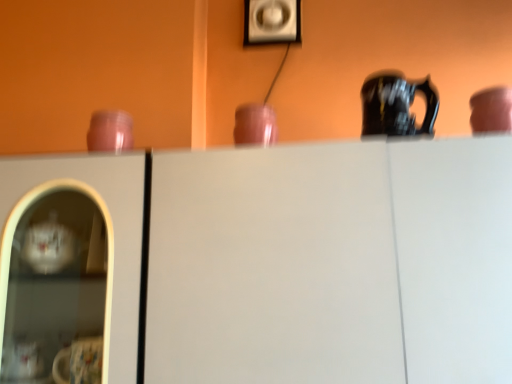
The width and height of the screenshot is (512, 384). Describe the element at coordinates (260, 264) in the screenshot. I see `white matte cabinet at center` at that location.

Where is `pink glossy jar at left, placed as the third tableware when sorted from right to left`? pink glossy jar at left, placed as the third tableware when sorted from right to left is located at coordinates (110, 131).

This screenshot has height=384, width=512. I want to click on matte pink cup at center, acting as the second tableware starting from the right, so click(x=255, y=125).

Is matte pink cup at center, acting as the second tableware starting from the right, next to matte plastic picture frame at upper center?

They are not placed beside each other.

Between matte pink cup at center, acting as the second tableware starting from the right, and matte plastic picture frame at upper center, which one appears on the right side from the viewer's perspective?

matte plastic picture frame at upper center.

Is point (254, 116) closer to viewer compared to point (285, 20)?

Yes, point (254, 116) is closer to viewer.

Which of these two, matte pink cup at center, positioned as the second tableware in left-to-right order, or matte plastic picture frame at upper center, is wider?

matte pink cup at center, positioned as the second tableware in left-to-right order.

Which object is closer to the camera, pink glossy jar at left, which appears as the 1th tableware when viewed from the left, or black glossy jug at upper right?

black glossy jug at upper right.

Would you say pink glossy jar at left, which appears as the 1th tableware when viewed from the left, is outside black glossy jug at upper right?

pink glossy jar at left, which appears as the 1th tableware when viewed from the left, lies outside black glossy jug at upper right's area.

Which is more to the right, pink glossy jar at left, which appears as the 1th tableware when viewed from the left, or black glossy jug at upper right?

black glossy jug at upper right.

Find the location of a particular element. The width and height of the screenshot is (512, 384). the 2nd tableware behind the black glossy jug at upper right is located at coordinates (110, 131).

In terms of size, does matte pink cup at upper right, placed as the 3th tableware when sorted from left to right, appear bigger or smaller than pink glossy jar at left, placed as the third tableware when sorted from right to left?

matte pink cup at upper right, placed as the 3th tableware when sorted from left to right, is bigger than pink glossy jar at left, placed as the third tableware when sorted from right to left.

Does matte pink cup at upper right, which appears as the 1th tableware when viewed from the right, turn towards pink glossy jar at left, which appears as the 1th tableware when viewed from the left?

No, matte pink cup at upper right, which appears as the 1th tableware when viewed from the right, is not turned towards pink glossy jar at left, which appears as the 1th tableware when viewed from the left.

Image resolution: width=512 pixels, height=384 pixels. In order to click on the 2nd tableware directly above the pink glossy jar at left, placed as the third tableware when sorted from right to left (from a real-world perspective) in this screenshot , I will do `click(490, 110)`.

Can you confirm if matte pink cup at upper right, placed as the 3th tableware when sorted from left to right, is wider than pink glossy jar at left, which appears as the 1th tableware when viewed from the left?

Yes, matte pink cup at upper right, placed as the 3th tableware when sorted from left to right, is wider than pink glossy jar at left, which appears as the 1th tableware when viewed from the left.

Considering their positions, is matte plastic picture frame at upper center located in front of or behind matte pink cup at center, positioned as the second tableware in left-to-right order?

Visually, matte plastic picture frame at upper center is located behind matte pink cup at center, positioned as the second tableware in left-to-right order.

Considering the sizes of objects matte plastic picture frame at upper center and matte pink cup at center, acting as the second tableware starting from the right, in the image provided, who is thinner, matte plastic picture frame at upper center or matte pink cup at center, acting as the second tableware starting from the right,?

matte plastic picture frame at upper center is thinner.

Are white matte cabinet at center and matte pink cup at center, positioned as the second tableware in left-to-right order, located far from each other?

No, white matte cabinet at center is not far from matte pink cup at center, positioned as the second tableware in left-to-right order.

Looking at this image, who is smaller, white matte cabinet at center or matte pink cup at center, positioned as the second tableware in left-to-right order?

matte pink cup at center, positioned as the second tableware in left-to-right order.

Is white matte cabinet at center not within matte pink cup at center, acting as the second tableware starting from the right?

Yes.

Does black glossy jug at upper right lie behind pink glossy jar at left, placed as the third tableware when sorted from right to left?

No, the depth of black glossy jug at upper right is less than that of pink glossy jar at left, placed as the third tableware when sorted from right to left.

In the scene shown: How distant is black glossy jug at upper right from pink glossy jar at left, placed as the third tableware when sorted from right to left?

black glossy jug at upper right and pink glossy jar at left, placed as the third tableware when sorted from right to left, are 19.68 inches apart.

Are black glossy jug at upper right and pink glossy jar at left, which appears as the 1th tableware when viewed from the left, located far from each other?

No, black glossy jug at upper right is not far away from pink glossy jar at left, which appears as the 1th tableware when viewed from the left.

From the image's perspective, between black glossy jug at upper right and pink glossy jar at left, which appears as the 1th tableware when viewed from the left, which one is located above?

black glossy jug at upper right appears higher in the image.

Could you measure the distance between white matte cabinet at center and matte pink cup at upper right, which appears as the 1th tableware when viewed from the right?

white matte cabinet at center is 20.06 inches away from matte pink cup at upper right, which appears as the 1th tableware when viewed from the right.

Which is behind, point (83, 203) or point (507, 111)?

The point (83, 203) is behind.

From the image's perspective, which is above, white matte cabinet at center or matte pink cup at upper right, which appears as the 1th tableware when viewed from the right?

matte pink cup at upper right, which appears as the 1th tableware when viewed from the right, is shown above in the image.

The width and height of the screenshot is (512, 384). What are the coordinates of `the 2nd tableware below the matte plastic picture frame at upper center (from the image's perspective)` in the screenshot? It's located at (x=255, y=125).

Image resolution: width=512 pixels, height=384 pixels. I want to click on jug on the right side of pink glossy jar at left, which appears as the 1th tableware when viewed from the left, so tap(396, 105).

Based on their spatial positions, is matte pink cup at upper right, which appears as the 1th tableware when viewed from the right, or matte pink cup at center, acting as the second tableware starting from the right, further from white matte cabinet at center?

matte pink cup at upper right, which appears as the 1th tableware when viewed from the right, is further to white matte cabinet at center.

Based on the photo, based on their spatial positions, is black glossy jug at upper right or matte plastic picture frame at upper center closer to matte pink cup at upper right, which appears as the 1th tableware when viewed from the right?

black glossy jug at upper right lies closer to matte pink cup at upper right, which appears as the 1th tableware when viewed from the right, than the other object.

From the image, which object appears to be farther from pink glossy jar at left, which appears as the 1th tableware when viewed from the left, matte plastic picture frame at upper center or matte pink cup at upper right, which appears as the 1th tableware when viewed from the right?

matte pink cup at upper right, which appears as the 1th tableware when viewed from the right, lies further to pink glossy jar at left, which appears as the 1th tableware when viewed from the left, than the other object.

Which object lies nearer to the anchor point black glossy jug at upper right, matte pink cup at center, positioned as the second tableware in left-to-right order, or matte plastic picture frame at upper center?

matte pink cup at center, positioned as the second tableware in left-to-right order, lies closer to black glossy jug at upper right than the other object.

Which object lies further to the anchor point matte plastic picture frame at upper center, pink glossy jar at left, placed as the third tableware when sorted from right to left, or white matte cabinet at center?

The object further to matte plastic picture frame at upper center is white matte cabinet at center.

Which object lies nearer to the anchor point pink glossy jar at left, which appears as the 1th tableware when viewed from the left, matte pink cup at upper right, which appears as the 1th tableware when viewed from the right, or matte pink cup at center, positioned as the second tableware in left-to-right order?

matte pink cup at center, positioned as the second tableware in left-to-right order, is closer to pink glossy jar at left, which appears as the 1th tableware when viewed from the left.

From the image, which object appears to be nearer to white matte cabinet at center, matte pink cup at center, positioned as the second tableware in left-to-right order, or matte plastic picture frame at upper center?

matte pink cup at center, positioned as the second tableware in left-to-right order, is positioned closer to the anchor white matte cabinet at center.

Estimate the real-world distances between objects in this image. Which object is further from matte pink cup at upper right, which appears as the 1th tableware when viewed from the right, matte pink cup at center, positioned as the second tableware in left-to-right order, or black glossy jug at upper right?

matte pink cup at center, positioned as the second tableware in left-to-right order, lies further to matte pink cup at upper right, which appears as the 1th tableware when viewed from the right, than the other object.

Find the location of a particular element. jug between white matte cabinet at center and matte plastic picture frame at upper center from front to back is located at coordinates (396, 105).

Find the location of a particular element. The image size is (512, 384). tableware between pink glossy jar at left, which appears as the 1th tableware when viewed from the left, and black glossy jug at upper right, in the horizontal direction is located at coordinates (255, 125).

Where is `tableware situated between pink glossy jar at left, placed as the third tableware when sorted from right to left, and matte pink cup at upper right, placed as the 3th tableware when sorted from left to right, from left to right`? This screenshot has width=512, height=384. tableware situated between pink glossy jar at left, placed as the third tableware when sorted from right to left, and matte pink cup at upper right, placed as the 3th tableware when sorted from left to right, from left to right is located at coordinates (255, 125).

Where is `jug between matte pink cup at upper right, placed as the 3th tableware when sorted from left to right, and matte plastic picture frame at upper center in the front-back direction`? This screenshot has width=512, height=384. jug between matte pink cup at upper right, placed as the 3th tableware when sorted from left to right, and matte plastic picture frame at upper center in the front-back direction is located at coordinates (396, 105).